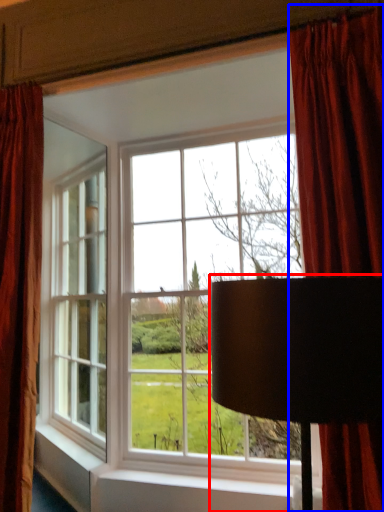
Question: Which object is further to the camera taking this photo, table lamp (highlighted by a red box) or curtain (highlighted by a blue box)?

Choices:
 (A) table lamp
 (B) curtain

Answer: (B)